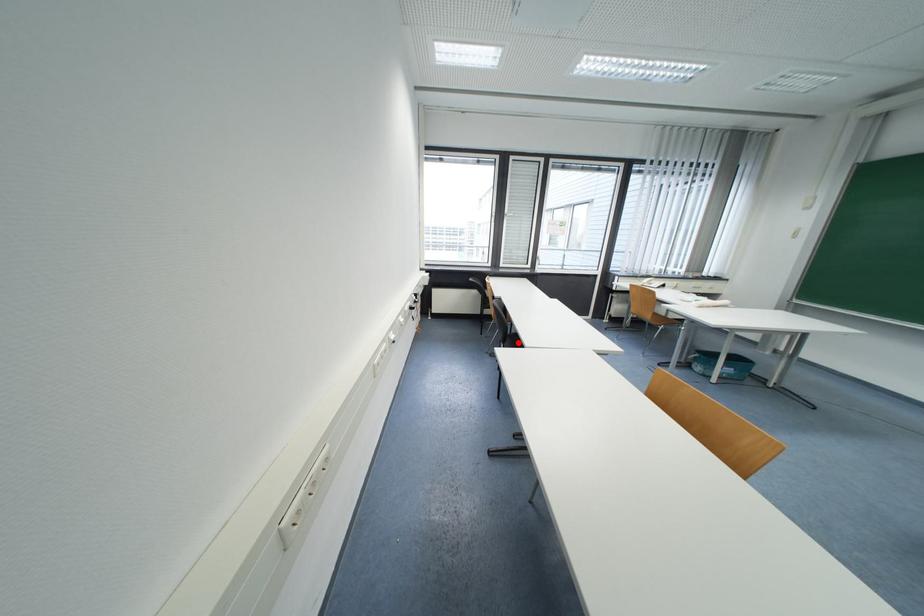
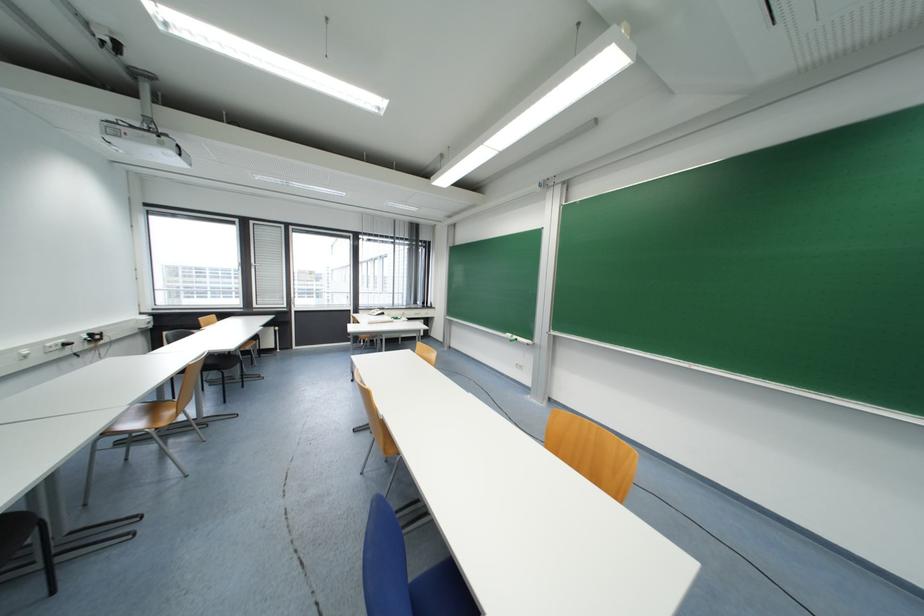
Question: I am providing you with two images of the same scene from different viewpoints. A red point is marked on the first image. Is the red point's position out of view in image 2?

Choices:
 (A) Yes
 (B) No

Answer: (A)